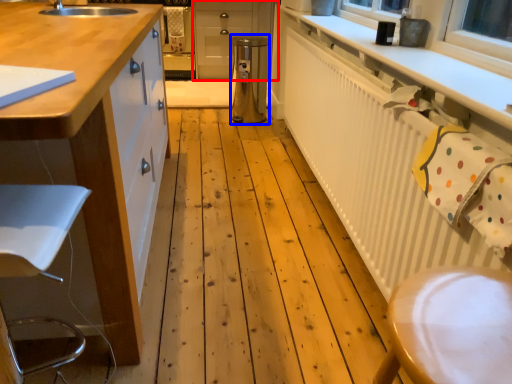
Question: Which of the following is the farthest to the observer, cabinetry (highlighted by a red box) or appliance (highlighted by a blue box)?

Choices:
 (A) cabinetry
 (B) appliance

Answer: (A)